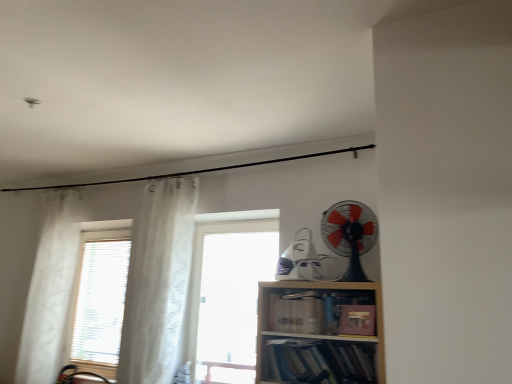
Question: Considering their positions, is transparent glass window at center located in front of or behind white sheer curtain at left, which is counted as the first curtain, starting from the right?

Choices:
 (A) front
 (B) behind

Answer: (B)

Question: Is transparent glass window at center bigger or smaller than white sheer curtain at left, arranged as the second curtain when viewed from the left?

Choices:
 (A) small
 (B) big

Answer: (B)

Question: Which of these objects is positioned closest to the brown leather book at lower right, acting as the 1th book starting from the top?

Choices:
 (A) matte cardboard book at center-right, the 2th book in the top-to-bottom sequence
 (B) hardcover books at lower center, the 3th book from the top
 (C) wooden bookshelf at center
 (D) white sheer curtain at left, which is counted as the first curtain, starting from the right
 (E) transparent glass window at center

Answer: (A)

Question: Which object is positioned farthest from the matte cardboard book at center-right, the 2th book in the top-to-bottom sequence?

Choices:
 (A) wooden bookshelf at center
 (B) transparent glass window at center
 (C) hardcover books at lower center, the 3th book from the top
 (D) black plastic fan at upper right
 (E) brown leather book at lower right, acting as the 1th book starting from the top

Answer: (B)